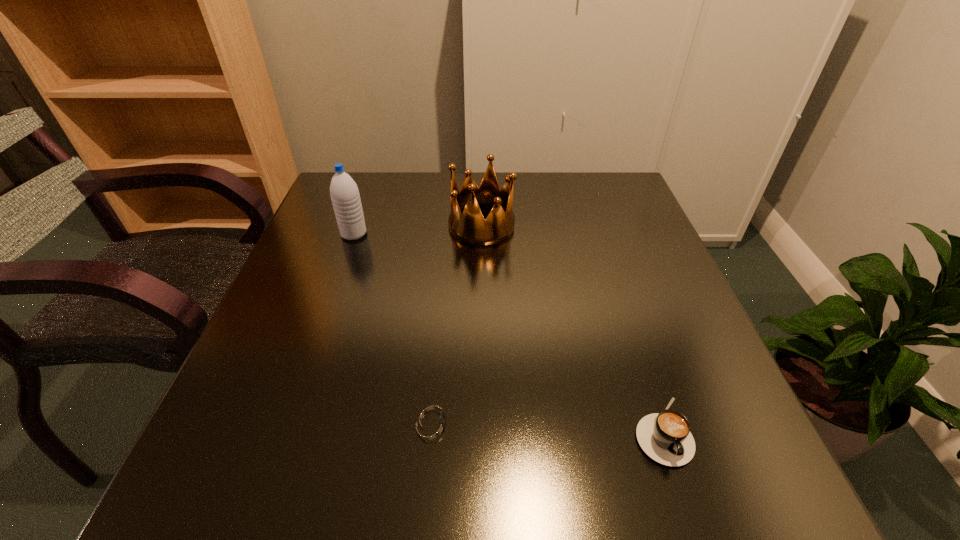
Find the location of a particular element. vacant space at the near right corner is located at coordinates (729, 491).

This screenshot has width=960, height=540. What are the coordinates of `vacant space that's between the second tallest object and the water bottle` in the screenshot? It's located at (418, 230).

Where is `free spot between the shortest object and the crown`? The width and height of the screenshot is (960, 540). free spot between the shortest object and the crown is located at coordinates (457, 323).

At what (x,y) coordinates should I click in order to perform the action: click on free space between the third shortest object and the second shortest object. Please return your answer as a coordinate pair (x, y). This screenshot has width=960, height=540. Looking at the image, I should click on (571, 328).

What are the coordinates of `blank region between the shortest object and the water bottle` in the screenshot? It's located at (393, 328).

At what (x,y) coordinates should I click in order to perform the action: click on empty location between the shortest object and the third shortest object. Please return your answer as a coordinate pair (x, y). This screenshot has width=960, height=540. Looking at the image, I should click on (457, 323).

Find the location of `free space between the water bottle and the rightmost object`. free space between the water bottle and the rightmost object is located at coordinates (508, 332).

Where is `free spot between the crown and the shortest object`? The width and height of the screenshot is (960, 540). free spot between the crown and the shortest object is located at coordinates (457, 323).

Image resolution: width=960 pixels, height=540 pixels. In order to click on vacant space that is in between the second tallest object and the third tallest object in this screenshot , I will do `click(571, 328)`.

The height and width of the screenshot is (540, 960). I want to click on free space that is in between the second shortest object and the water bottle, so coord(508,332).